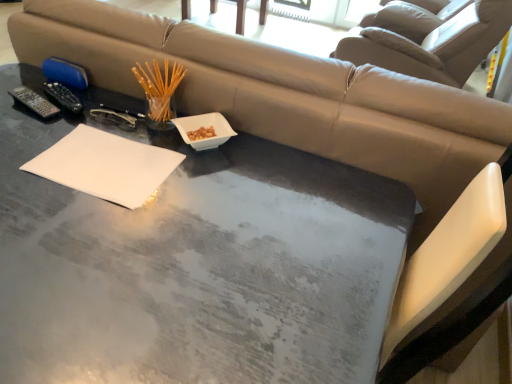
Locate an element on the screen. This screenshot has width=512, height=384. vacant area that is in front of black plastic remote at left is located at coordinates pyautogui.click(x=24, y=135).